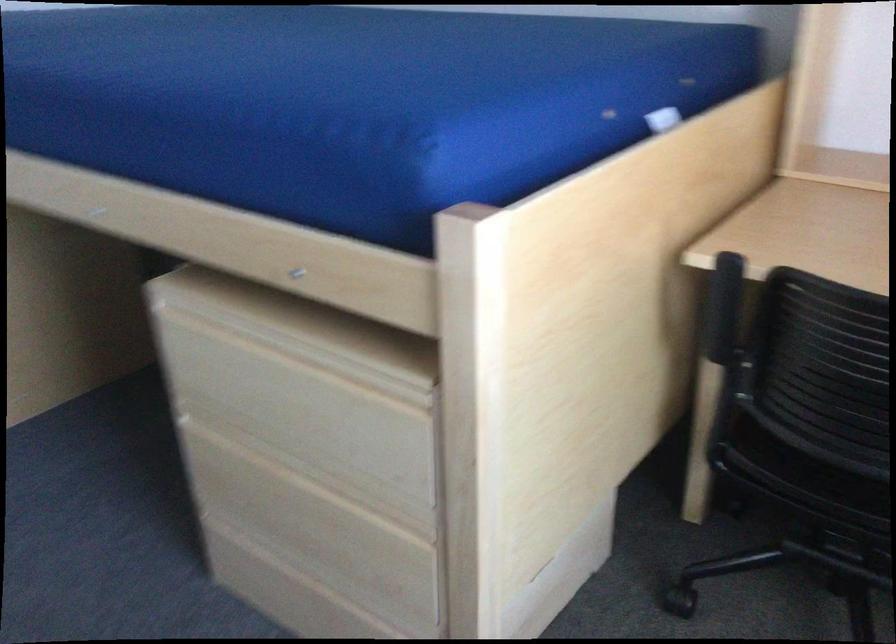
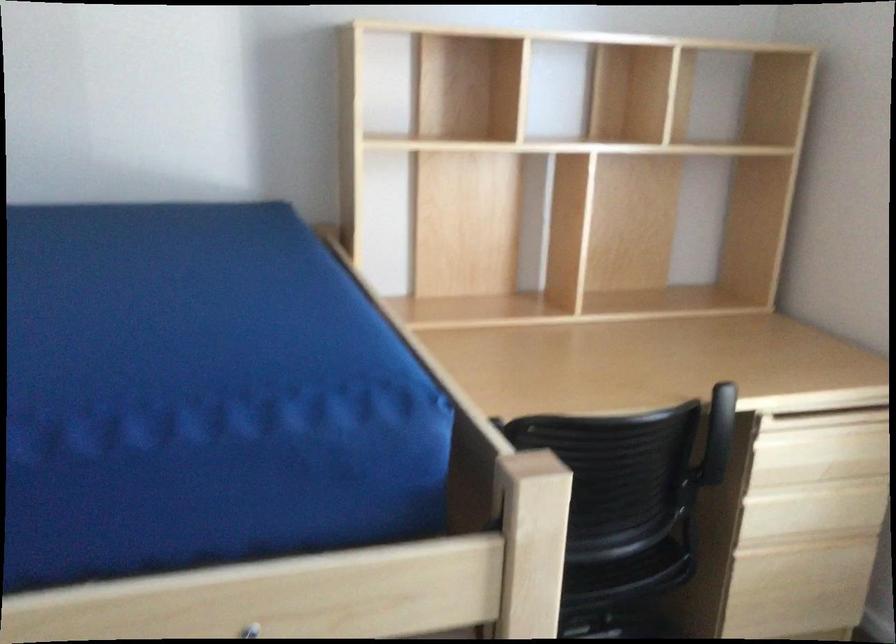
The point at (308, 278) is marked in the first image. Where is the corresponding point in the second image?

(250, 630)